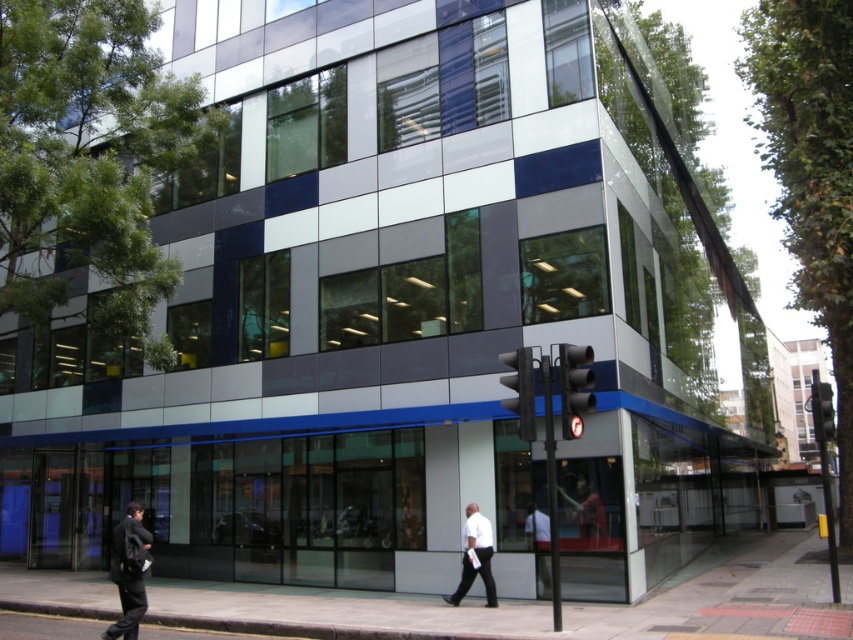
Question: Can you confirm if smooth concrete pavement at lower center is positioned below white matte shirt at center?

Choices:
 (A) no
 (B) yes

Answer: (B)

Question: Among these objects, which one is nearest to the camera?

Choices:
 (A) white matte shirt at center
 (B) white fabric shirt at lower center
 (C) smooth concrete pavement at lower center
 (D) dark gray suit at lower left

Answer: (C)

Question: Does dark gray suit at lower left have a smaller size compared to white matte shirt at center?

Choices:
 (A) no
 (B) yes

Answer: (B)

Question: Among these points, which one is nearest to the camera?

Choices:
 (A) (480, 554)
 (B) (225, 596)

Answer: (A)

Question: Which is nearer to the dark gray suit at lower left?

Choices:
 (A) white matte shirt at center
 (B) smooth concrete pavement at lower center
 (C) white fabric shirt at lower center

Answer: (A)

Question: Does smooth concrete pavement at lower center have a greater width compared to white fabric shirt at lower center?

Choices:
 (A) yes
 (B) no

Answer: (A)